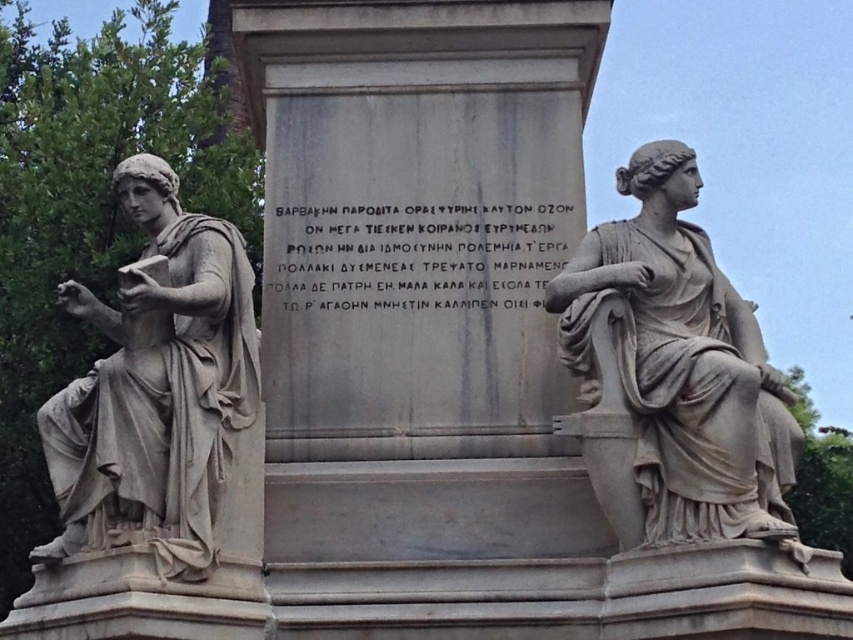
Does matte gray statue at right have a larger size compared to matte gray statue at left?

Yes, matte gray statue at right is bigger than matte gray statue at left.

Based on the photo, does matte gray statue at right appear on the right side of matte gray statue at left?

Indeed, matte gray statue at right is positioned on the right side of matte gray statue at left.

You are a GUI agent. You are given a task and a screenshot of the screen. Output one action in this format:
    pyautogui.click(x=<x>, y=<y>)
    Task: Click on the matte gray statue at right
    Image resolution: width=853 pixels, height=640 pixels.
    Given the screenshot: What is the action you would take?
    pyautogui.click(x=675, y=372)